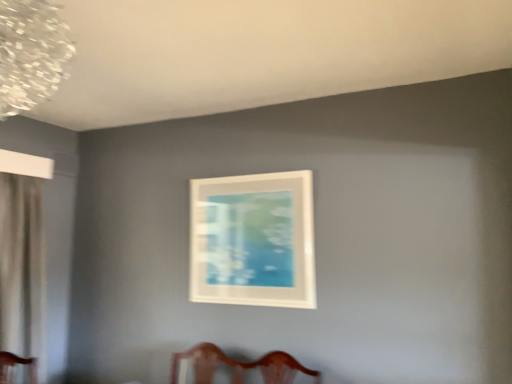
Question: Considering the relative positions of clear crystal chandelier at upper left and white sheer curtain at left in the image provided, is clear crystal chandelier at upper left to the right of white sheer curtain at left from the viewer's perspective?

Choices:
 (A) yes
 (B) no

Answer: (A)

Question: Would you say white sheer curtain at left is part of clear crystal chandelier at upper left's contents?

Choices:
 (A) no
 (B) yes

Answer: (A)

Question: Considering the relative sizes of clear crystal chandelier at upper left and white sheer curtain at left in the image provided, is clear crystal chandelier at upper left shorter than white sheer curtain at left?

Choices:
 (A) no
 (B) yes

Answer: (B)

Question: From the image's perspective, is clear crystal chandelier at upper left located above white sheer curtain at left?

Choices:
 (A) yes
 (B) no

Answer: (A)

Question: From a real-world perspective, is clear crystal chandelier at upper left over white sheer curtain at left?

Choices:
 (A) yes
 (B) no

Answer: (A)

Question: Looking at the image, does clear crystal chandelier at upper left seem bigger or smaller compared to white matte picture frame at center?

Choices:
 (A) small
 (B) big

Answer: (B)

Question: From a real-world perspective, is clear crystal chandelier at upper left physically located above or below white matte picture frame at center?

Choices:
 (A) above
 (B) below

Answer: (A)

Question: Considering the positions of clear crystal chandelier at upper left and white matte picture frame at center in the image, is clear crystal chandelier at upper left taller or shorter than white matte picture frame at center?

Choices:
 (A) tall
 (B) short

Answer: (B)

Question: From the image's perspective, is clear crystal chandelier at upper left located above or below white matte picture frame at center?

Choices:
 (A) below
 (B) above

Answer: (B)

Question: Is white matte picture frame at center to the left or to the right of white sheer curtain at left in the image?

Choices:
 (A) left
 (B) right

Answer: (B)

Question: From the image's perspective, is white matte picture frame at center positioned above or below white sheer curtain at left?

Choices:
 (A) below
 (B) above

Answer: (B)

Question: Is point (289, 296) positioned closer to the camera than point (14, 223)?

Choices:
 (A) farther
 (B) closer

Answer: (B)

Question: In terms of height, does white matte picture frame at center look taller or shorter compared to white sheer curtain at left?

Choices:
 (A) short
 (B) tall

Answer: (A)

Question: From the image's perspective, is white sheer curtain at left above or below clear crystal chandelier at upper left?

Choices:
 (A) above
 (B) below

Answer: (B)

Question: Based on their positions, is white sheer curtain at left located to the left or right of clear crystal chandelier at upper left?

Choices:
 (A) left
 (B) right

Answer: (A)